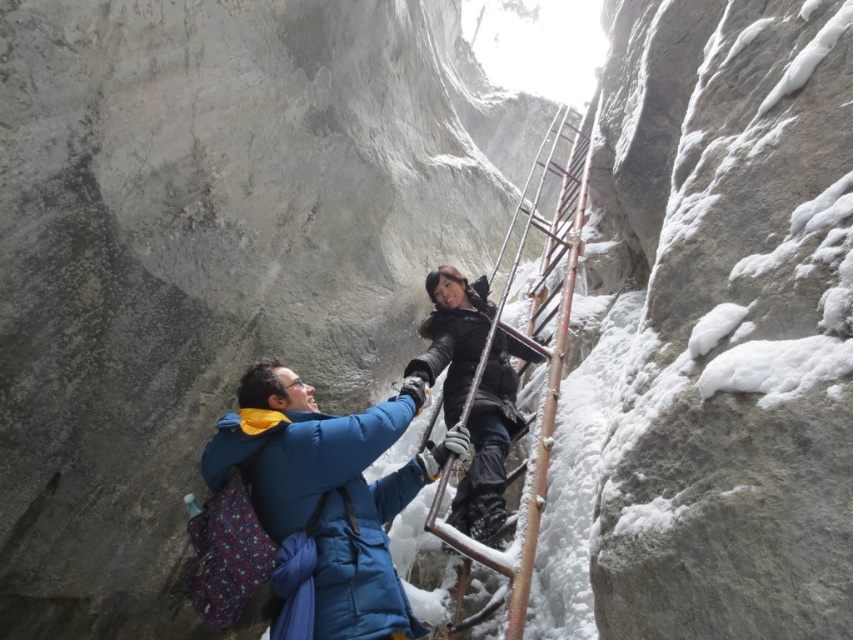
You are a photographer trying to capture a clear photo of both the blue down jacket at center and the black matte jacket at center. Since the lighting is diffused, you need to adjust your camera settings to ensure both are visible. Given their positions, which jacket should you focus on to ensure the other remains in the background?

You should focus on the blue down jacket at center because it is in front of the black matte jacket at center, so the latter will naturally be in the background.